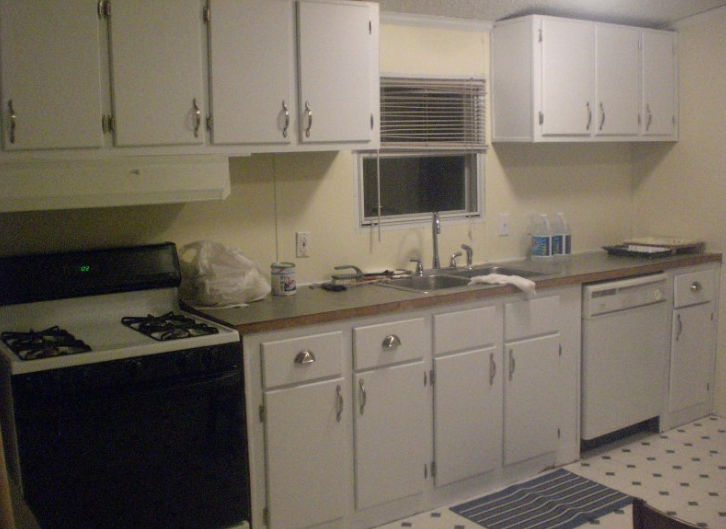
What are the coordinates of `dishwasher` in the screenshot? It's located at (636, 358).